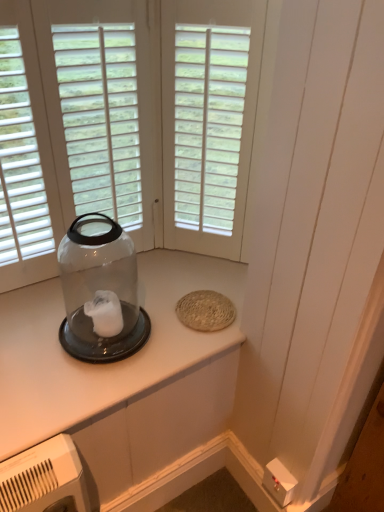
Locate an element on the screen. The image size is (384, 512). vacant space to the left of white matte window at center is located at coordinates (154, 266).